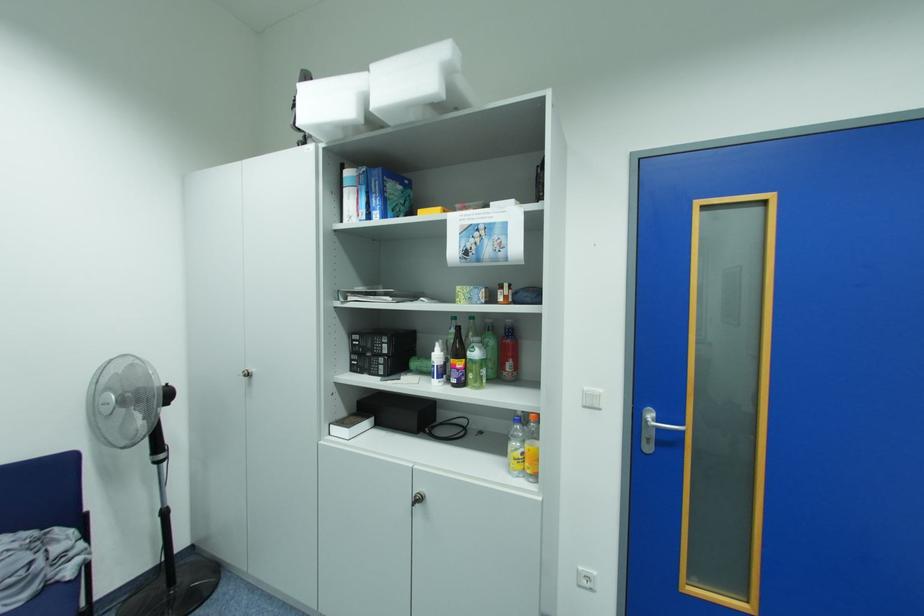
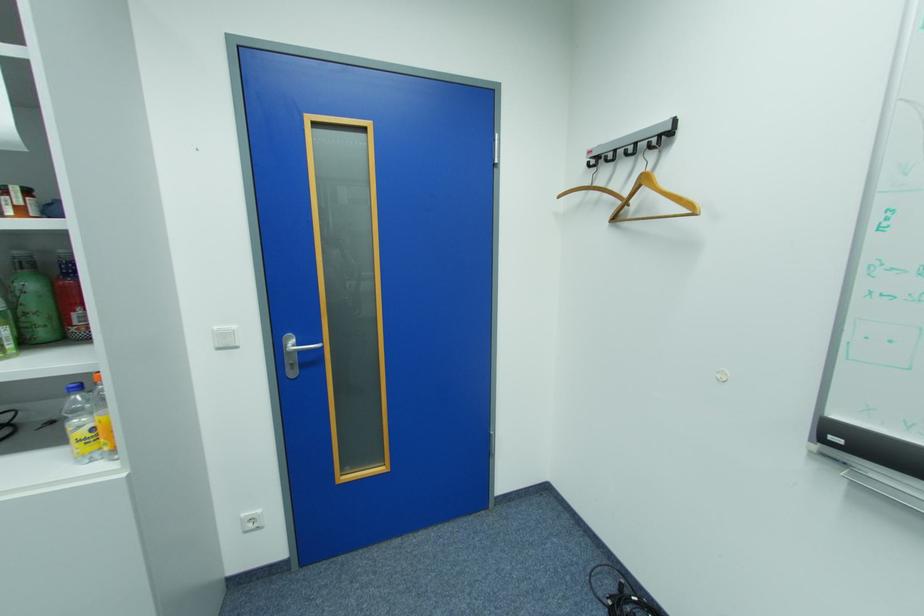
Locate, in the second image, the point that corresponds to point 516,322 in the first image.

(69, 252)